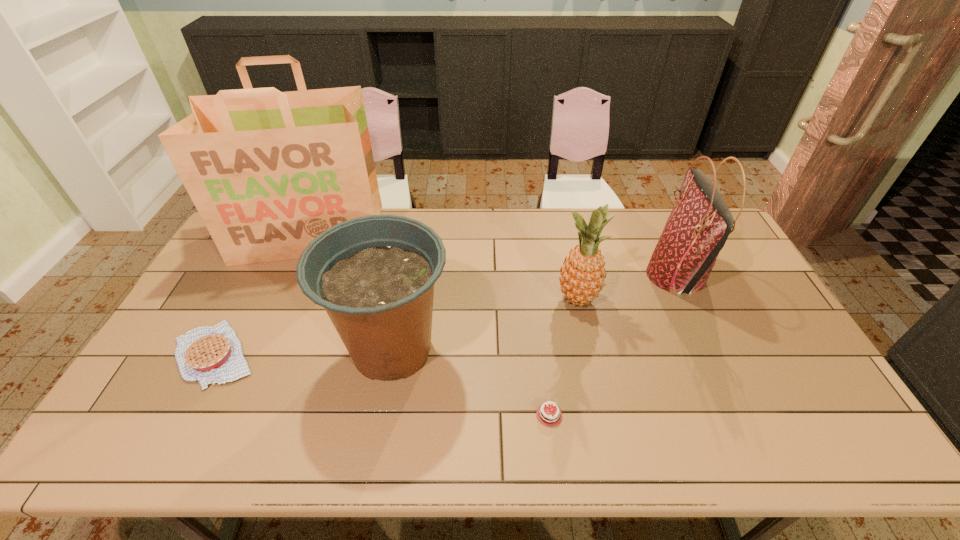
Find the location of `free space between the fifth tallest object and the grocery bag`. free space between the fifth tallest object and the grocery bag is located at coordinates (262, 294).

Identify the location of blank region between the handbag and the pineapple. The height and width of the screenshot is (540, 960). (627, 288).

The image size is (960, 540). In order to click on the fifth closest object relative to the tallest object in this screenshot , I will do `click(700, 222)`.

Identify the location of object that stands as the fifth closest to the second shortest object. (700, 222).

Image resolution: width=960 pixels, height=540 pixels. I want to click on free location that satisfies the following two spatial constraints: 1. on the back side of the fifth tallest object; 2. on the left side of the tallest object, so click(277, 235).

Locate an element on the screen. This screenshot has width=960, height=540. free spot that satisfies the following two spatial constraints: 1. on the front side of the rightmost object; 2. on the left side of the tallest object is located at coordinates (292, 276).